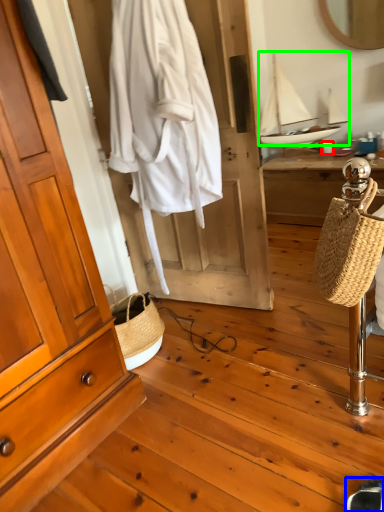
Question: Which is nearer to the coffee cup (highlighted by a red box)? shoe (highlighted by a blue box) or sailboat (highlighted by a green box).

Choices:
 (A) shoe
 (B) sailboat

Answer: (B)